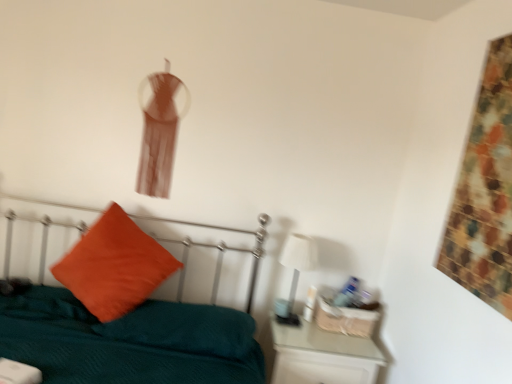
Question: Is teal fabric bed at center completely or partially outside of white glossy table lamp at right?

Choices:
 (A) yes
 (B) no

Answer: (A)

Question: Is there a large distance between teal fabric bed at center and white glossy table lamp at right?

Choices:
 (A) no
 (B) yes

Answer: (A)

Question: Is teal fabric bed at center smaller than white glossy table lamp at right?

Choices:
 (A) no
 (B) yes

Answer: (A)

Question: Considering the relative sizes of teal fabric bed at center and white glossy table lamp at right in the image provided, is teal fabric bed at center wider than white glossy table lamp at right?

Choices:
 (A) yes
 (B) no

Answer: (A)

Question: Is teal fabric bed at center at the left side of white glossy table lamp at right?

Choices:
 (A) no
 (B) yes

Answer: (B)

Question: From a real-world perspective, is teal fabric bed at center physically below white glossy table lamp at right?

Choices:
 (A) yes
 (B) no

Answer: (A)

Question: Does teal fabric bed at center have a lesser width compared to orange velvet pillow at left?

Choices:
 (A) yes
 (B) no

Answer: (B)

Question: From the image's perspective, is teal fabric bed at center on orange velvet pillow at left?

Choices:
 (A) yes
 (B) no

Answer: (B)

Question: Does teal fabric bed at center come behind orange velvet pillow at left?

Choices:
 (A) yes
 (B) no

Answer: (B)

Question: From the image's perspective, does teal fabric bed at center appear lower than orange velvet pillow at left?

Choices:
 (A) no
 (B) yes

Answer: (B)

Question: Is orange velvet pillow at left inside teal fabric bed at center?

Choices:
 (A) yes
 (B) no

Answer: (A)

Question: Considering the relative sizes of teal fabric bed at center and orange velvet pillow at left in the image provided, is teal fabric bed at center smaller than orange velvet pillow at left?

Choices:
 (A) no
 (B) yes

Answer: (A)

Question: Considering the relative positions of orange velvet pillow at left and white glossy nightstand at lower right in the image provided, is orange velvet pillow at left to the left of white glossy nightstand at lower right from the viewer's perspective?

Choices:
 (A) yes
 (B) no

Answer: (A)